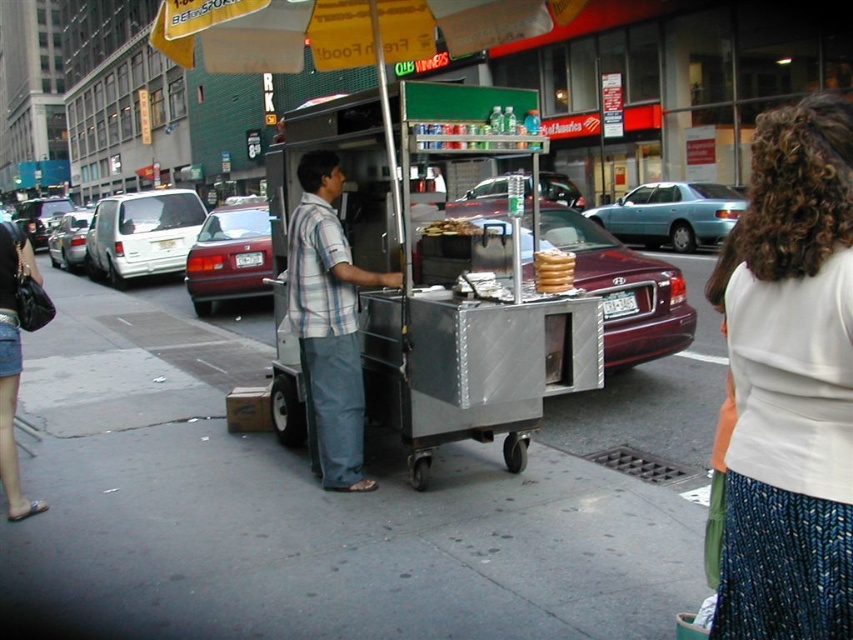
Between white knit sweater at upper right and slightly toasted bread at center, which one appears on the right side from the viewer's perspective?

white knit sweater at upper right

Between point (804, 396) and point (430, 225), which one is positioned in front?

Point (804, 396) is more forward.

Where is `white knit sweater at upper right`? The width and height of the screenshot is (853, 640). white knit sweater at upper right is located at coordinates (791, 385).

In the scene shown: Does metallic silver cart at center have a lesser height compared to slightly toasted bread at center?

Incorrect, metallic silver cart at center's height does not fall short of slightly toasted bread at center's.

Is metallic silver cart at center further to camera compared to slightly toasted bread at center?

No.

This screenshot has height=640, width=853. Identify the location of metallic silver cart at center. (432, 282).

Is metallic silver cart at center to the left of white knit sweater at upper right from the viewer's perspective?

Correct, you'll find metallic silver cart at center to the left of white knit sweater at upper right.

Between metallic silver cart at center and white knit sweater at upper right, which one is positioned higher?

metallic silver cart at center is higher up.

Which is behind, point (509, 289) or point (753, 145)?

Point (509, 289)

Identify the location of metallic silver cart at center. The height and width of the screenshot is (640, 853). (432, 282).